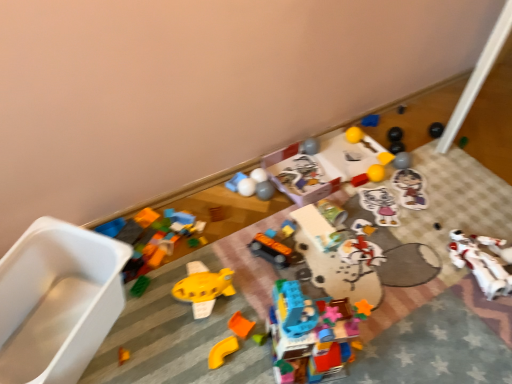
At what (x,y) coordinates should I click in order to perform the action: click on vacant space that's between yellow rubber ball at upper center, acting as the fifteenth toy starting from the left, and matte white plush cat at center, the thirteenth toy viewed from the left. Please return your answer as a coordinate pair (x, y). Image resolution: width=512 pixels, height=384 pixels. Looking at the image, I should click on click(x=382, y=181).